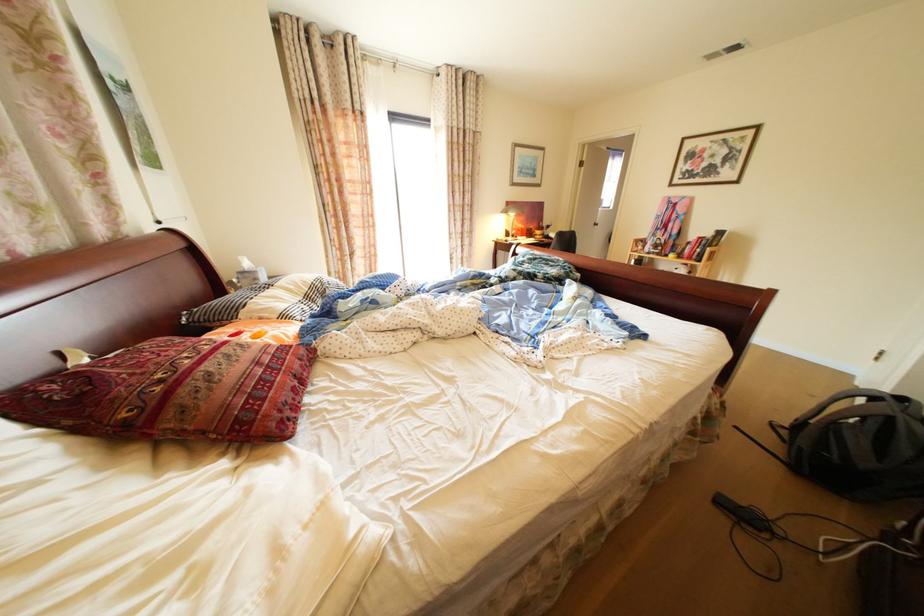
What do you see at coordinates (844, 403) in the screenshot? I see `a backpack strap` at bounding box center [844, 403].